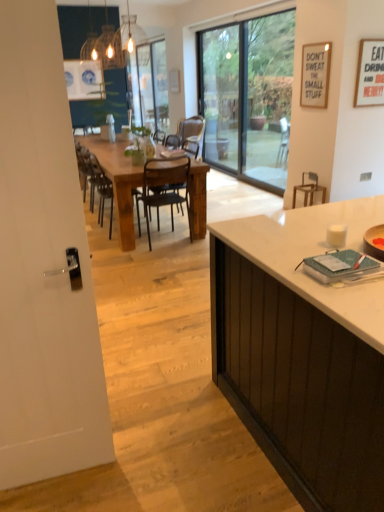
Question: Considering the relative sizes of matte glass chandelier at upper center and wooden chair at center, the 3th chair positioned from the right, in the image provided, is matte glass chandelier at upper center thinner than wooden chair at center, the 3th chair positioned from the right,?

Choices:
 (A) yes
 (B) no

Answer: (A)

Question: Is matte glass chandelier at upper center outside wooden chair at center, acting as the 1th chair starting from the left?

Choices:
 (A) yes
 (B) no

Answer: (A)

Question: Are matte glass chandelier at upper center and wooden chair at center, the 3th chair positioned from the right, located far from each other?

Choices:
 (A) yes
 (B) no

Answer: (A)

Question: Does matte glass chandelier at upper center turn towards wooden chair at center, the 3th chair positioned from the right?

Choices:
 (A) yes
 (B) no

Answer: (B)

Question: Does matte glass chandelier at upper center have a smaller size compared to wooden chair at center, acting as the 1th chair starting from the left?

Choices:
 (A) yes
 (B) no

Answer: (A)

Question: Is matte glass chandelier at upper center shorter than wooden chair at center, acting as the 1th chair starting from the left?

Choices:
 (A) no
 (B) yes

Answer: (B)

Question: Does rustic wood table at center have a larger size compared to metallic black chair at center, the second chair viewed from the left?

Choices:
 (A) yes
 (B) no

Answer: (A)

Question: Can you confirm if rustic wood table at center is thinner than metallic black chair at center, the second chair in the right-to-left sequence?

Choices:
 (A) no
 (B) yes

Answer: (A)

Question: Is rustic wood table at center smaller than metallic black chair at center, the second chair in the right-to-left sequence?

Choices:
 (A) no
 (B) yes

Answer: (A)

Question: Is the position of rustic wood table at center less distant than that of metallic black chair at center, the second chair viewed from the left?

Choices:
 (A) no
 (B) yes

Answer: (A)

Question: From the image's perspective, does rustic wood table at center appear higher than metallic black chair at center, the second chair viewed from the left?

Choices:
 (A) yes
 (B) no

Answer: (A)

Question: From a real-world perspective, is rustic wood table at center physically below metallic black chair at center, the second chair viewed from the left?

Choices:
 (A) yes
 (B) no

Answer: (A)

Question: Can you confirm if wooden chair at center, the 3th chair positioned from the right, is positioned to the right of white matte cabinet at right?

Choices:
 (A) no
 (B) yes

Answer: (A)